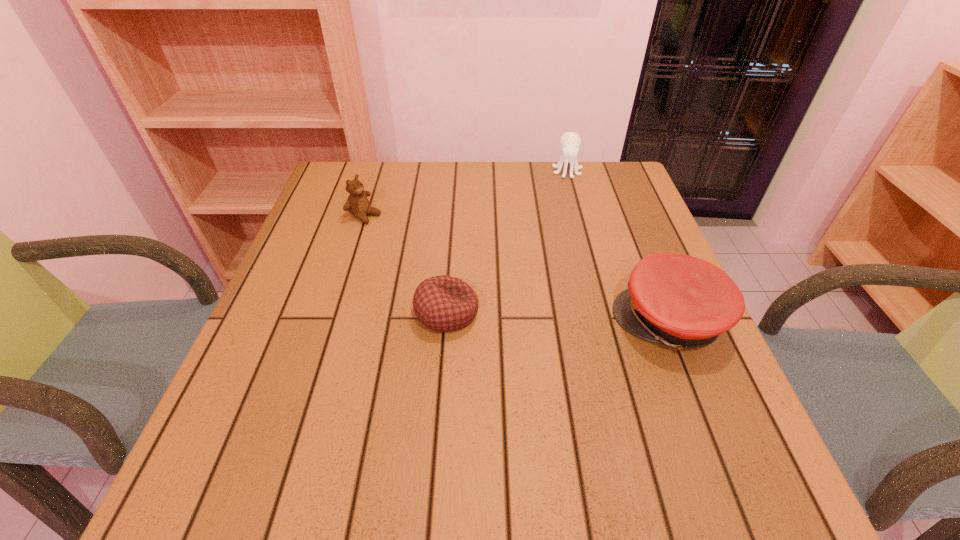
The height and width of the screenshot is (540, 960). In order to click on vacant region located 0.350m at the face of the third nearest object in this screenshot , I will do `click(491, 273)`.

The height and width of the screenshot is (540, 960). I want to click on vacant space situated at the face of the third nearest object, so click(410, 236).

Locate an element on the screen. vacant space located at the face of the third nearest object is located at coordinates point(451,255).

In order to click on vacant space located on the front-facing side of the octopus in this screenshot , I will do `click(572, 235)`.

This screenshot has height=540, width=960. Identify the location of vacant region located on the front-facing side of the octopus. (568, 190).

This screenshot has height=540, width=960. In order to click on free point located 0.380m on the front-facing side of the octopus in this screenshot , I will do pyautogui.click(x=575, y=268).

This screenshot has width=960, height=540. In order to click on teddy bear at the far edge in this screenshot , I will do `click(357, 204)`.

The width and height of the screenshot is (960, 540). Find the location of `octopus positioned at the far edge`. octopus positioned at the far edge is located at coordinates (570, 142).

This screenshot has height=540, width=960. I want to click on object present at the left edge, so click(x=357, y=204).

Where is `cap that is at the right edge`? The height and width of the screenshot is (540, 960). cap that is at the right edge is located at coordinates (681, 301).